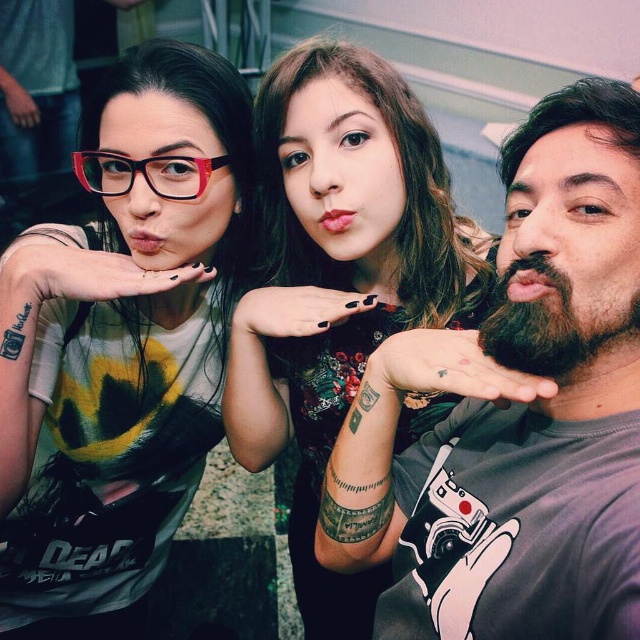
Who is shorter, dark brown thick beard at right or translucent plastic glasses at upper left?

translucent plastic glasses at upper left

Is dark brown thick beard at right below translucent plastic glasses at upper left?

Yes.

Image resolution: width=640 pixels, height=640 pixels. Identify the location of dark brown thick beard at right. (548, 324).

Find the location of a particular element. Image resolution: width=640 pixels, height=640 pixels. matte black glasses at upper left is located at coordinates (122, 346).

This screenshot has width=640, height=640. Find the location of `matte black glasses at upper left`. matte black glasses at upper left is located at coordinates (122, 346).

Who is shorter, bearded man at center or matte black glasses at upper left?

bearded man at center

Does bearded man at center come behind matte black glasses at upper left?

That is False.

The image size is (640, 640). I want to click on bearded man at center, so click(516, 412).

Where is `bearded man at center`? bearded man at center is located at coordinates (516, 412).